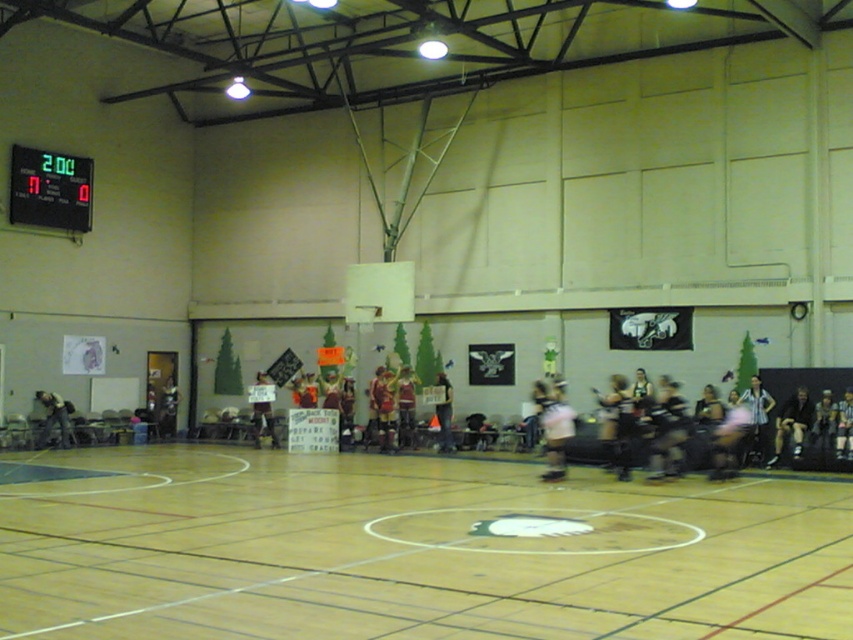
Question: Considering the real-world distances, which object is closest to the matte red jersey at center?

Choices:
 (A) white jersey at center
 (B) pink fabric at center

Answer: (A)

Question: Which object appears farthest from the camera in this image?

Choices:
 (A) pink fabric at center
 (B) black leather jacket at lower right
 (C) matte red jersey at center

Answer: (C)

Question: Does matte black jacket at center have a larger size compared to white jersey at center?

Choices:
 (A) yes
 (B) no

Answer: (A)

Question: Which of the following is the closest to the observer?

Choices:
 (A) matte black jacket at lower left
 (B) pink fabric at center

Answer: (B)

Question: Is wooden floor at center thinner than pink fabric at center?

Choices:
 (A) yes
 (B) no

Answer: (B)

Question: Considering the relative positions of matte black jacket at lower left and matte red jersey at center in the image provided, where is matte black jacket at lower left located with respect to matte red jersey at center?

Choices:
 (A) below
 (B) above

Answer: (A)